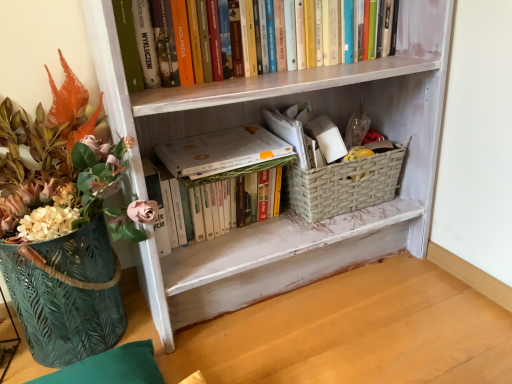
The image size is (512, 384). I want to click on vacant space underneath green textured basket at left (from a real-world perspective), so click(x=101, y=340).